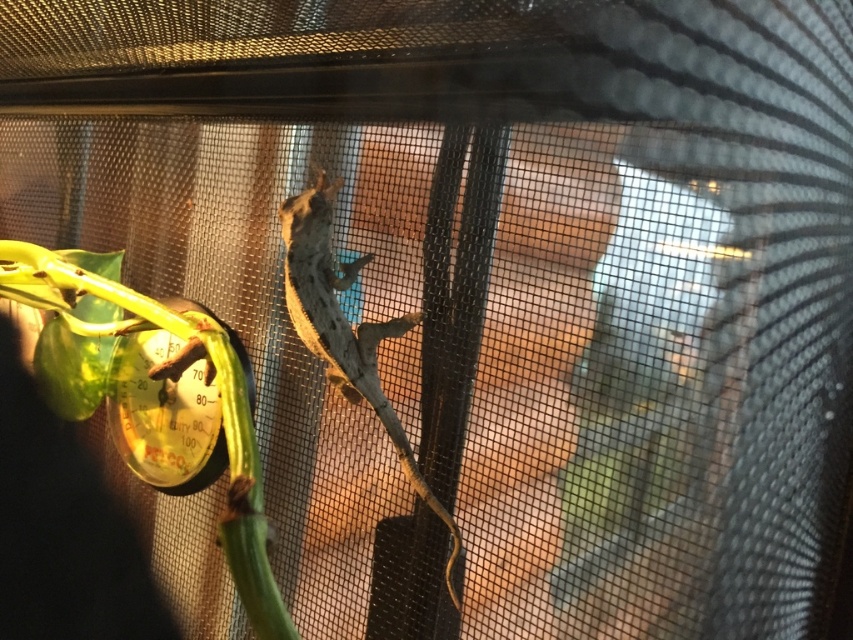
You are a reptile keeper checking the enclosure. You see the green leafy plant at left and the smooth gray lizard at center. Which object is closer to the front of the enclosure?

The green leafy plant at left is positioned over the smooth gray lizard at center, meaning it is closer to the front of the enclosure.

You are a caretaker of this terrarium and need to check the distance between the green leafy plant at left and the smooth gray lizard at center. Can you confirm if the space between them is more than 10 inches?

The distance between the green leafy plant at left and the smooth gray lizard at center is 11.87 inches, so yes, the space between them is more than 10 inches.